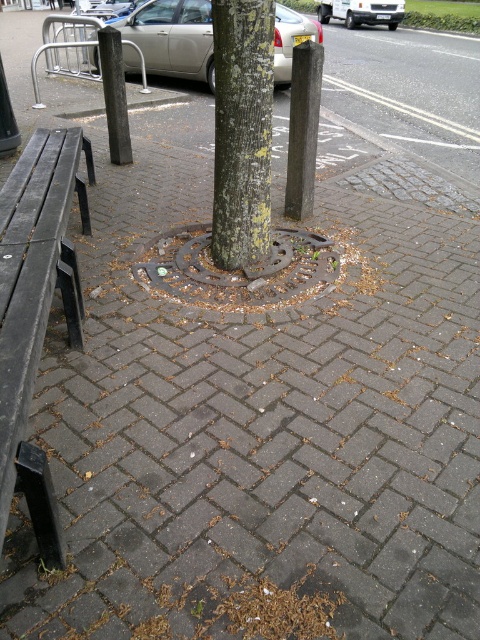
You are a city planner assessing the placement of the matte black bench at left and the dark gray textured pole at left. Based on their positions, is the bench located under the pole or to the side of it?

The matte black bench at left is positioned under the dark gray textured pole at left, so the bench is located under the pole.

You are a delivery robot navigating an urban area. You need to move from your current position to a drop point located at point (184,51). There is an obstacle at point (383,3). Can you safely reach the drop point without passing through the obstacle?

Yes, because point (184,51) is in front of point (383,3), so the delivery robot can reach the drop point without passing through the obstacle.